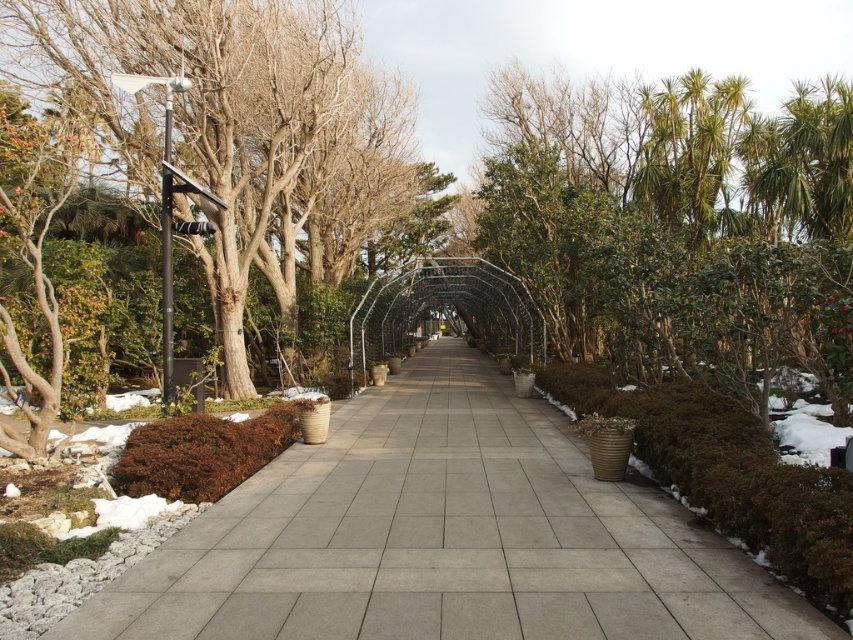
Can you confirm if gray concrete pavement at center is smaller than brown matte bush at lower left?

Indeed, gray concrete pavement at center has a smaller size compared to brown matte bush at lower left.

Can you confirm if gray concrete pavement at center is thinner than brown matte bush at lower left?

No, gray concrete pavement at center is not thinner than brown matte bush at lower left.

Where is `gray concrete pavement at center`? The image size is (853, 640). gray concrete pavement at center is located at coordinates (444, 538).

Does gray concrete pavement at center have a greater height compared to green leafy tree at center?

No.

Which of these two, gray concrete pavement at center or green leafy tree at center, stands taller?

With more height is green leafy tree at center.

Identify the location of gray concrete pavement at center. Image resolution: width=853 pixels, height=640 pixels. (444, 538).

Does gray concrete pavement at center appear under dark green textured bush at right?

Indeed, gray concrete pavement at center is positioned under dark green textured bush at right.

Is gray concrete pavement at center thinner than dark green textured bush at right?

Incorrect, gray concrete pavement at center's width is not less than dark green textured bush at right's.

Locate an element on the screen. The height and width of the screenshot is (640, 853). gray concrete pavement at center is located at coordinates (444, 538).

Where is `gray concrete pavement at center`? The height and width of the screenshot is (640, 853). gray concrete pavement at center is located at coordinates (444, 538).